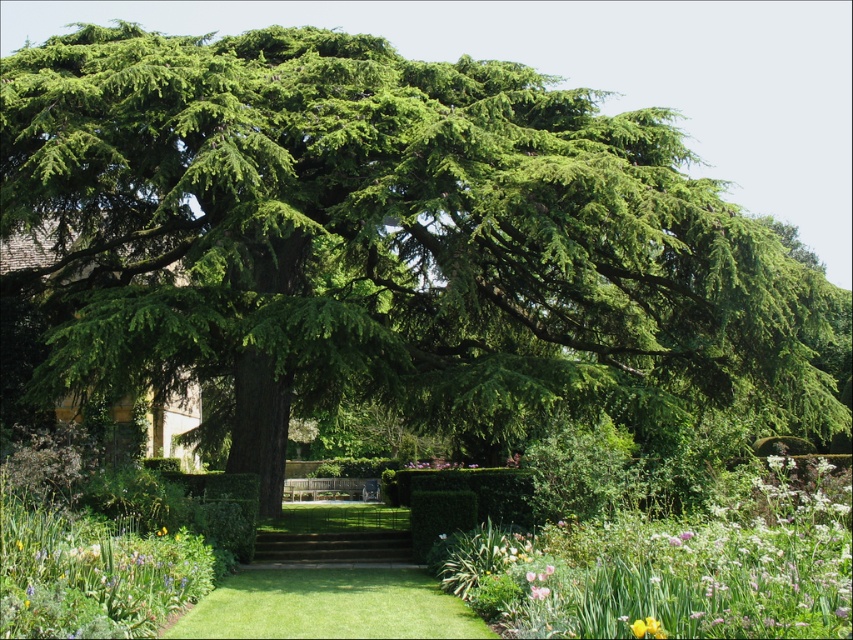
Question: Which is farther from the yellow matte flower at lower right?

Choices:
 (A) soft pink petal at center
 (B) brown wooden stairs at center

Answer: (B)

Question: Does brown wooden stairs at center have a smaller size compared to yellow matte flower at lower right?

Choices:
 (A) no
 (B) yes

Answer: (A)

Question: Can you confirm if brown wooden stairs at center is positioned above soft pink petal at center?

Choices:
 (A) no
 (B) yes

Answer: (A)

Question: Which point appears farthest from the camera in this image?

Choices:
 (A) (370, 544)
 (B) (648, 625)
 (C) (534, 586)

Answer: (A)

Question: Estimate the real-world distances between objects in this image. Which object is closer to the soft pink petal at center?

Choices:
 (A) brown wooden stairs at center
 (B) yellow matte flower at lower right

Answer: (B)

Question: Considering the relative positions of brown wooden stairs at center and soft pink petal at center in the image provided, where is brown wooden stairs at center located with respect to soft pink petal at center?

Choices:
 (A) right
 (B) left

Answer: (B)